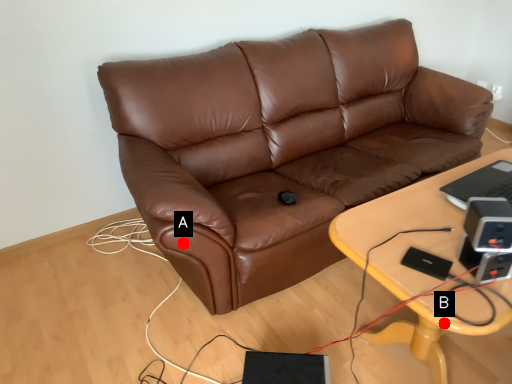
Question: Two points are circled on the image, labeled by A and B beside each circle. Which point is farther from the camera taking this photo?

Choices:
 (A) A is further
 (B) B is further

Answer: (A)